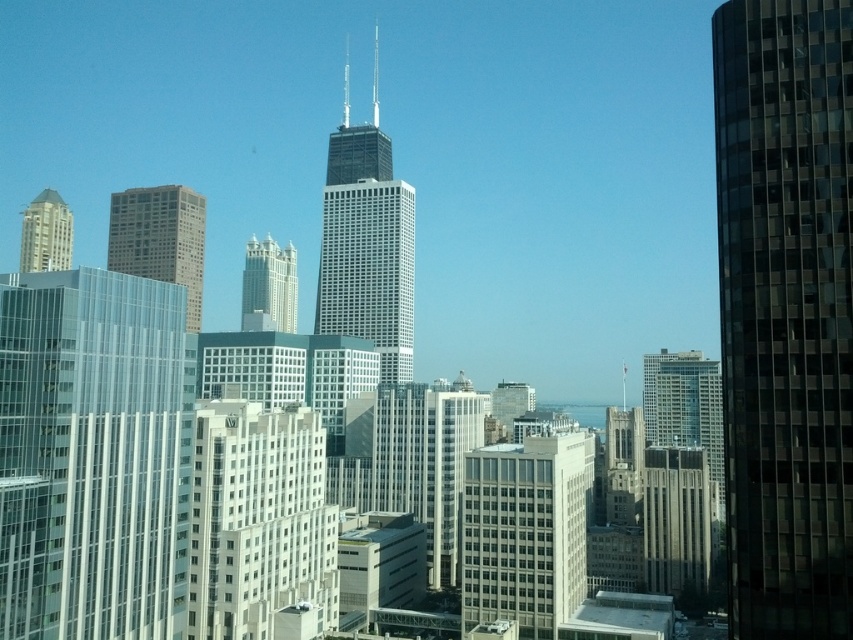
Question: Based on their relative distances, which object is farther from the matte glass skyscraper at center?

Choices:
 (A) beige glass building at center
 (B) matte gold building at upper left
 (C) matte glass skyscraper at center-left
 (D) black glass skyscraper at right

Answer: (D)

Question: Among these objects, which one is nearest to the camera?

Choices:
 (A) black glass skyscraper at right
 (B) matte glass skyscraper at center-left

Answer: (A)

Question: Does transparent glass building at left appear on the left side of white glass building at center?

Choices:
 (A) yes
 (B) no

Answer: (B)

Question: Can you confirm if matte glass skyscraper at center-left is thinner than glassy reflective skyscraper at center-right?

Choices:
 (A) no
 (B) yes

Answer: (A)

Question: Which point appears farthest from the camera in this image?

Choices:
 (A) (558, 497)
 (B) (682, 412)
 (C) (44, 460)
 (D) (816, 100)

Answer: (B)

Question: Can you confirm if white glass building at center is bigger than matte gold building at upper left?

Choices:
 (A) no
 (B) yes

Answer: (A)